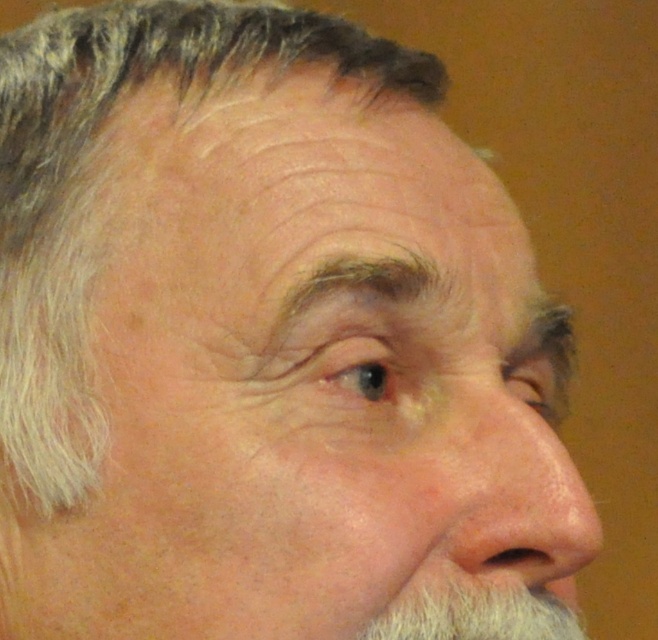
Is gray matte hair at upper left smaller than white fuzzy beard at lower right?

No, gray matte hair at upper left is not smaller than white fuzzy beard at lower right.

Between point (88, 380) and point (572, 637), which one is positioned behind?

Positioned behind is point (572, 637).

Where is `gray matte hair at upper left`? The image size is (658, 640). gray matte hair at upper left is located at coordinates click(x=118, y=193).

Which is above, gray matte hair at upper left or dry skin nose at center?

Positioned higher is gray matte hair at upper left.

Is point (80, 236) farther from camera compared to point (532, 582)?

That is True.

Is point (409, 60) less distant than point (557, 525)?

No, (409, 60) is behind (557, 525).

The height and width of the screenshot is (640, 658). Identify the location of gray matte hair at upper left. (118, 193).

Can you confirm if dry skin nose at center is thinner than white fuzzy beard at lower right?

Yes, dry skin nose at center is thinner than white fuzzy beard at lower right.

Does dry skin nose at center have a lesser height compared to white fuzzy beard at lower right?

No.

Is point (519, 442) in front of point (422, 608)?

No, it is behind (422, 608).

Locate an element on the screen. This screenshot has height=640, width=658. dry skin nose at center is located at coordinates click(526, 499).